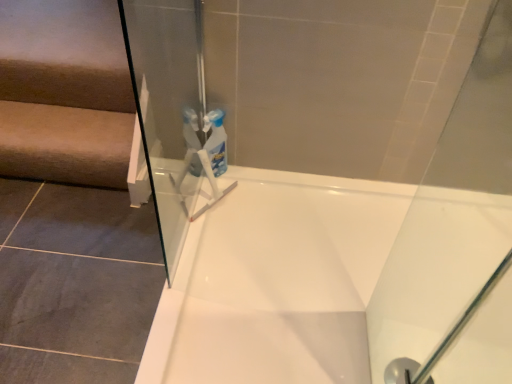
Question: Is white glossy bathtub at center thinner than transparent glass shower at lower right?

Choices:
 (A) no
 (B) yes

Answer: (A)

Question: Is transparent glass shower at lower right surrounded by white glossy bathtub at center?

Choices:
 (A) no
 (B) yes

Answer: (B)

Question: Does white glossy bathtub at center come in front of transparent glass shower at lower right?

Choices:
 (A) yes
 (B) no

Answer: (A)

Question: Is white glossy bathtub at center in contact with transparent glass shower at lower right?

Choices:
 (A) yes
 (B) no

Answer: (B)

Question: Can you confirm if white glossy bathtub at center is shorter than transparent glass shower at lower right?

Choices:
 (A) no
 (B) yes

Answer: (A)

Question: Relative to beige fabric stairwell at left, is transparent glass shower at lower right in front or behind?

Choices:
 (A) front
 (B) behind

Answer: (A)

Question: Considering the positions of transparent glass shower at lower right and beige fabric stairwell at left in the image, is transparent glass shower at lower right wider or thinner than beige fabric stairwell at left?

Choices:
 (A) thin
 (B) wide

Answer: (A)

Question: Would you say transparent glass shower at lower right is inside or outside beige fabric stairwell at left?

Choices:
 (A) inside
 (B) outside

Answer: (B)

Question: Visually, is transparent glass shower at lower right positioned to the left or to the right of beige fabric stairwell at left?

Choices:
 (A) left
 (B) right

Answer: (B)

Question: From a real-world perspective, relative to transparent glass shower at lower right, is white glossy bathtub at center vertically above or below?

Choices:
 (A) above
 (B) below

Answer: (A)

Question: Does point pos(324,372) appear closer or farther from the camera than point pos(412,370)?

Choices:
 (A) closer
 (B) farther

Answer: (A)

Question: From the image's perspective, is white glossy bathtub at center located above or below transparent glass shower at lower right?

Choices:
 (A) above
 (B) below

Answer: (A)

Question: In terms of height, does white glossy bathtub at center look taller or shorter compared to transparent glass shower at lower right?

Choices:
 (A) short
 (B) tall

Answer: (B)

Question: Is beige fabric stairwell at left to the left or to the right of transparent glass shower at lower right in the image?

Choices:
 (A) left
 (B) right

Answer: (A)

Question: Is beige fabric stairwell at left bigger or smaller than transparent glass shower at lower right?

Choices:
 (A) small
 (B) big

Answer: (B)